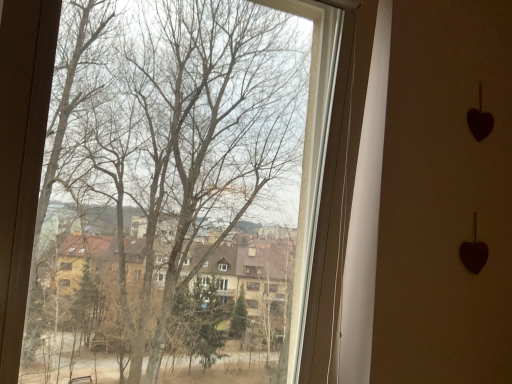
Question: Should I look upward or downward to see transparent glass tree at center?

Choices:
 (A) down
 (B) up

Answer: (B)